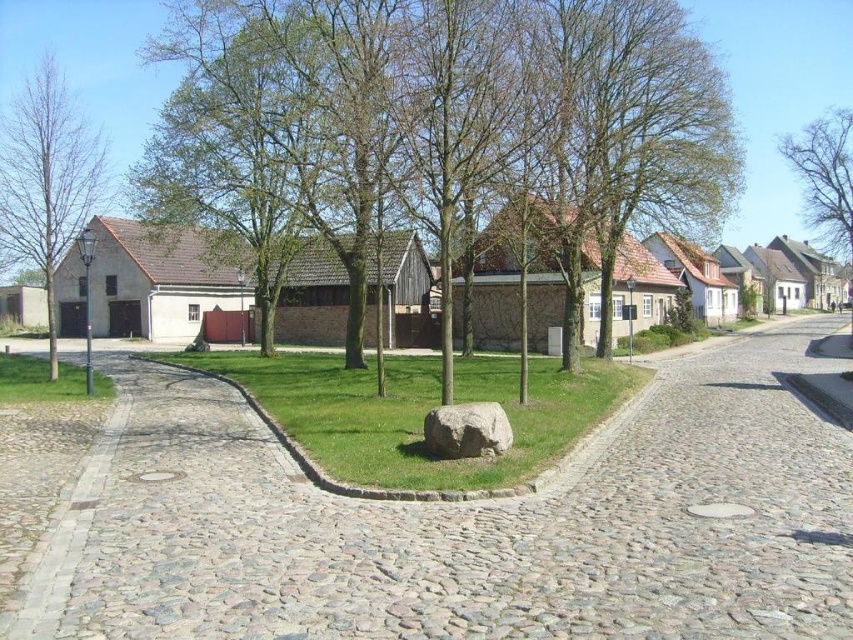
Question: Based on their relative distances, which object is nearer to the green leafy tree at center?

Choices:
 (A) green grass at center
 (B) green grass at lower left

Answer: (A)

Question: Which point is farther from the camera taking this photo?

Choices:
 (A) pyautogui.click(x=816, y=129)
 (B) pyautogui.click(x=440, y=406)
 (C) pyautogui.click(x=579, y=212)

Answer: (A)

Question: Can you confirm if green grass at center is positioned above green grass at lower left?

Choices:
 (A) no
 (B) yes

Answer: (A)

Question: Is green grass at center positioned before gray rough stone at center?

Choices:
 (A) yes
 (B) no

Answer: (A)

Question: Is cobblestone path at center to the right of bare branches at upper right from the viewer's perspective?

Choices:
 (A) no
 (B) yes

Answer: (A)

Question: Which is farther from the green grass at lower left?

Choices:
 (A) green grass at center
 (B) brown/rough tree at left

Answer: (B)